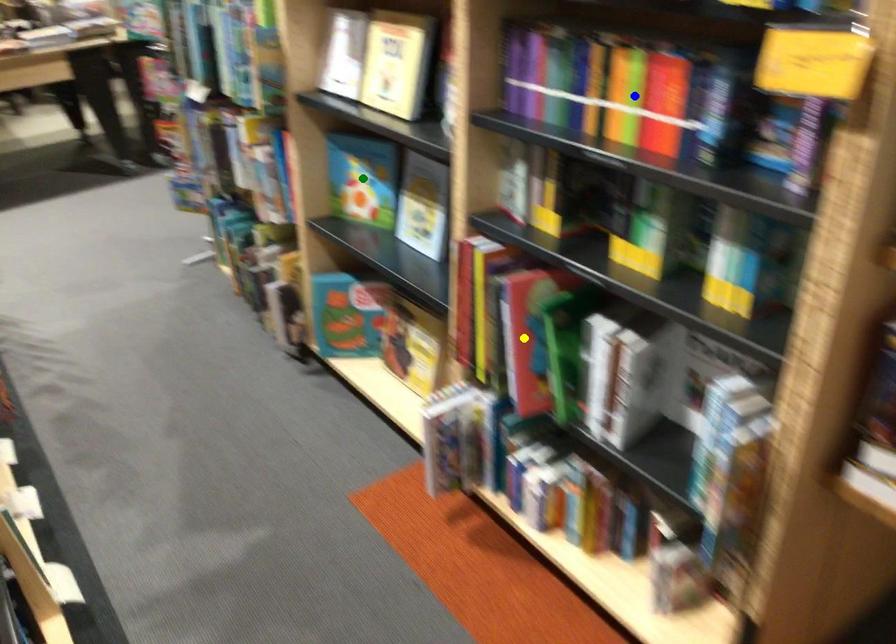
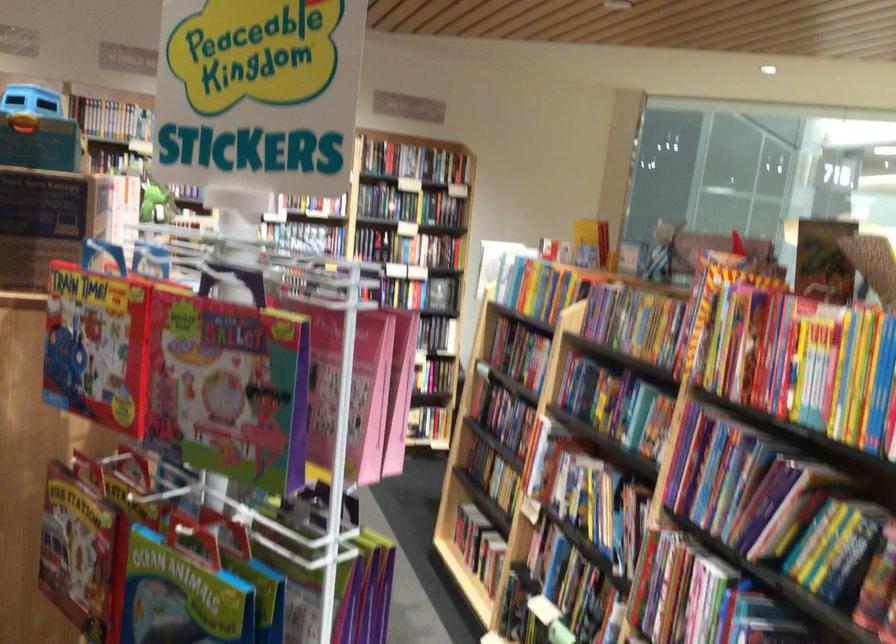
I am providing you with two images of the same scene from different viewpoints. Three points are marked in image1. Which point corresponds to a part or object that is occluded in image2?In image1, three points are marked. Which of them correspond to a part or object that is occluded in image2?Among the three points shown in image1, which one corresponds to a part or object that is no longer visible due to occlusion in image2?

yellow point, blue point, green point cannot be seen in image2.